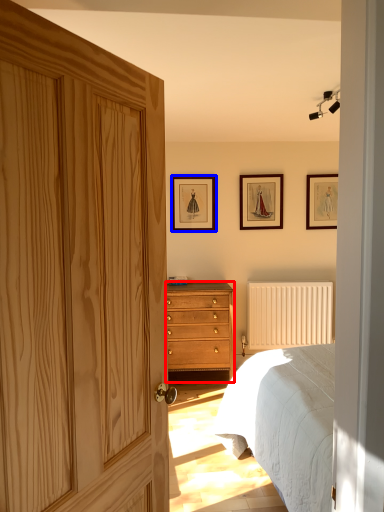
Question: Which object is further to the camera taking this photo, chest of drawers (highlighted by a red box) or picture frame (highlighted by a blue box)?

Choices:
 (A) chest of drawers
 (B) picture frame

Answer: (B)